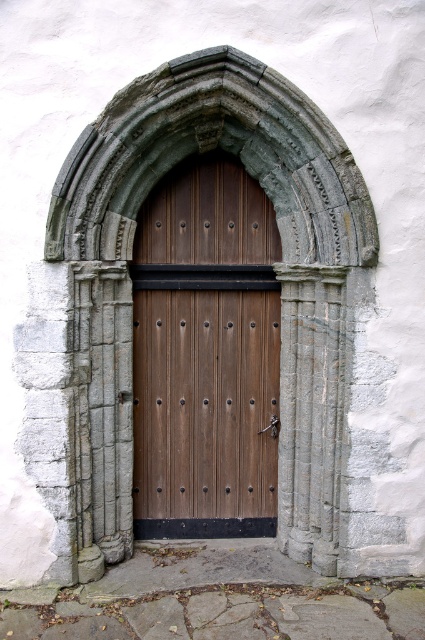
You are standing in front of the historic doorway and want to enter through the gray stone archway at center. Which side of the wooden door at center should you approach to find the entrance under the archway?

The wooden door at center is to the left of the gray stone archway at center, so you should approach the right side of the wooden door at center to find the entrance under the archway.

You are standing in front of the historic arched doorway. There are two points marked on the door. The first point is at coordinates point [246,440] and the second point is at point [249,116]. Which point is closer to you?

Point [246,440] is further to the camera than point [249,116], so the point closer to you is point [249,116].